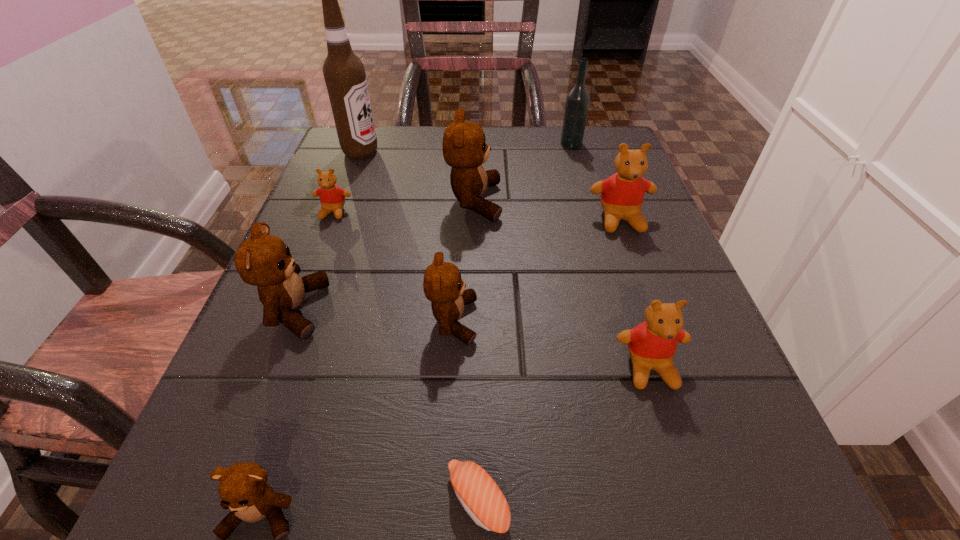
Identify the location of sushi. The height and width of the screenshot is (540, 960). (480, 496).

At what (x,y) coordinates should I click in order to perform the action: click on free spot located 0.320m on the label of the alcohol. Please return your answer as a coordinate pair (x, y). Looking at the image, I should click on (516, 152).

You are a GUI agent. You are given a task and a screenshot of the screen. Output one action in this format:
    pyautogui.click(x=<x>, y=<y>)
    Task: Click on the vacant space located 0.220m on the left of the vodka
    The height and width of the screenshot is (540, 960).
    Given the screenshot: What is the action you would take?
    click(x=469, y=144)

This screenshot has width=960, height=540. I want to click on vacant space situated on the front-facing side of the tallest teddy bear, so click(561, 202).

You are a GUI agent. You are given a task and a screenshot of the screen. Output one action in this format:
    pyautogui.click(x=<x>, y=<y>)
    Task: Click on the vacant space located 0.310m on the front-facing side of the third smallest brown teddy bear
    
    Given the screenshot: What is the action you would take?
    pyautogui.click(x=522, y=309)

You are a GUI agent. You are given a task and a screenshot of the screen. Output one action in this format:
    pyautogui.click(x=<x>, y=<y>)
    Task: Click on the free point located 0.230m on the front-facing side of the biggest red teddy bear
    
    Given the screenshot: What is the action you would take?
    pyautogui.click(x=662, y=335)

The width and height of the screenshot is (960, 540). Identify the location of vacant position located 0.230m on the front-facing side of the second smallest brown teddy bear. (627, 321).

Where is `free space located 0.070m on the front-facing side of the second smallest red teddy bear`? The image size is (960, 540). free space located 0.070m on the front-facing side of the second smallest red teddy bear is located at coordinates (673, 444).

This screenshot has width=960, height=540. What are the coordinates of `vacant space located 0.100m on the front-facing side of the smallest red teddy bear` in the screenshot? It's located at (317, 256).

Locate an element on the screen. free space located 0.230m on the back of the shortest object is located at coordinates (478, 315).